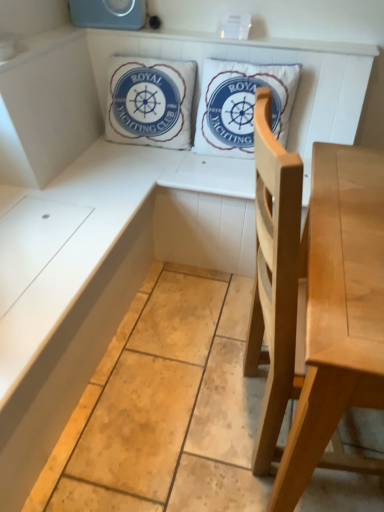
Question: Is light wood chair at center oriented away from white cotton pillow at upper center, which is the first pillow in right-to-left order?

Choices:
 (A) no
 (B) yes

Answer: (A)

Question: Does light wood chair at center have a smaller size compared to white cotton pillow at upper center, which is the first pillow in right-to-left order?

Choices:
 (A) no
 (B) yes

Answer: (A)

Question: Is white cotton pillow at upper center, which is the first pillow in right-to-left order, a part of light wood chair at center?

Choices:
 (A) yes
 (B) no

Answer: (B)

Question: From a real-world perspective, is light wood chair at center physically below white cotton pillow at upper center, which is the first pillow in right-to-left order?

Choices:
 (A) yes
 (B) no

Answer: (A)

Question: Can you confirm if light wood chair at center is positioned to the left of white cotton pillow at upper center, which is the first pillow in right-to-left order?

Choices:
 (A) yes
 (B) no

Answer: (B)

Question: Is white cotton cushion at upper center, the 1th pillow from the left, in front of or behind white cotton pillow at upper center, which appears as the second pillow when viewed from the left, in the image?

Choices:
 (A) behind
 (B) front

Answer: (A)

Question: Considering the positions of white cotton cushion at upper center, the 1th pillow from the left, and white cotton pillow at upper center, which is the first pillow in right-to-left order, in the image, is white cotton cushion at upper center, the 1th pillow from the left, wider or thinner than white cotton pillow at upper center, which is the first pillow in right-to-left order,?

Choices:
 (A) wide
 (B) thin

Answer: (B)

Question: From a real-world perspective, relative to white cotton pillow at upper center, which is the first pillow in right-to-left order, is white cotton cushion at upper center, the 1th pillow from the left, vertically above or below?

Choices:
 (A) below
 (B) above

Answer: (A)

Question: Is point (157, 95) positioned closer to the camera than point (198, 146)?

Choices:
 (A) closer
 (B) farther

Answer: (A)

Question: In terms of width, does light wood chair at center look wider or thinner when compared to white cotton cushion at upper center, the 1th pillow from the left?

Choices:
 (A) thin
 (B) wide

Answer: (B)

Question: Do you think light wood chair at center is within white cotton cushion at upper center, the 1th pillow from the left, or outside of it?

Choices:
 (A) outside
 (B) inside

Answer: (A)

Question: Looking at the image, does light wood chair at center seem bigger or smaller compared to white cotton cushion at upper center, the 2th pillow when ordered from right to left?

Choices:
 (A) small
 (B) big

Answer: (B)

Question: From the image's perspective, relative to white cotton cushion at upper center, the 1th pillow from the left, is light wood chair at center above or below?

Choices:
 (A) below
 (B) above

Answer: (A)

Question: Is white cotton cushion at upper center, the 2th pillow when ordered from right to left, wider or thinner than light wood chair at center?

Choices:
 (A) wide
 (B) thin

Answer: (B)

Question: Is white cotton cushion at upper center, the 2th pillow when ordered from right to left, in front of or behind light wood chair at center in the image?

Choices:
 (A) front
 (B) behind

Answer: (B)